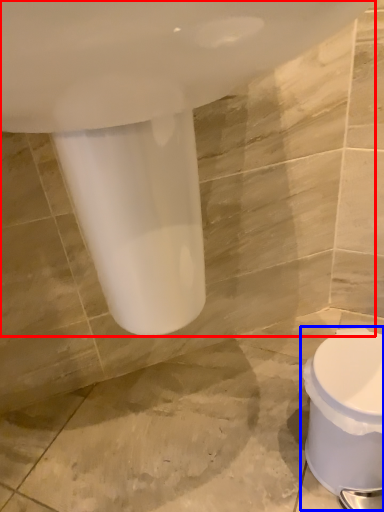
Question: Which of the following is the closest to the observer, bath (highlighted by a red box) or toilet (highlighted by a blue box)?

Choices:
 (A) bath
 (B) toilet

Answer: (A)